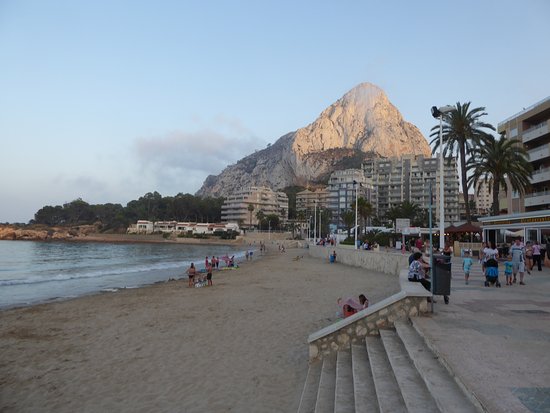
Locate an element on the screen. hotels is located at coordinates (254, 203), (307, 200), (352, 200), (394, 190), (430, 190), (534, 176).